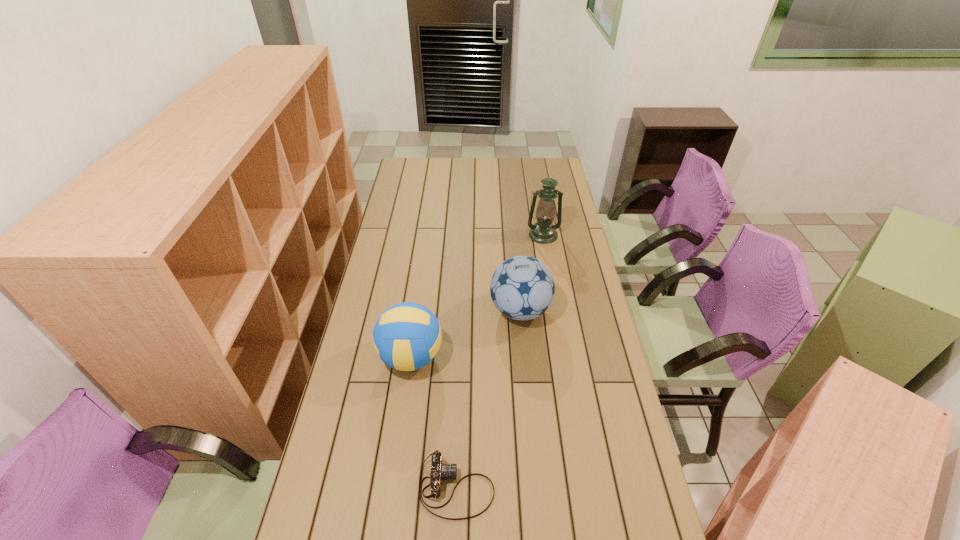
Select which object is the third closest to the volleyball. Please provide its 2D coordinates. Your answer should be formatted as a tuple, i.e. [(x, y)], where the tuple contains the x and y coordinates of a point satisfying the conditions above.

[(543, 231)]

At what (x,y) coordinates should I click in order to perform the action: click on free location that satisfies the following two spatial constraints: 1. on the side with brand of the soccer ball; 2. on the front side of the volleyball. Please return your answer as a coordinate pair (x, y). The image size is (960, 540). Looking at the image, I should click on (524, 357).